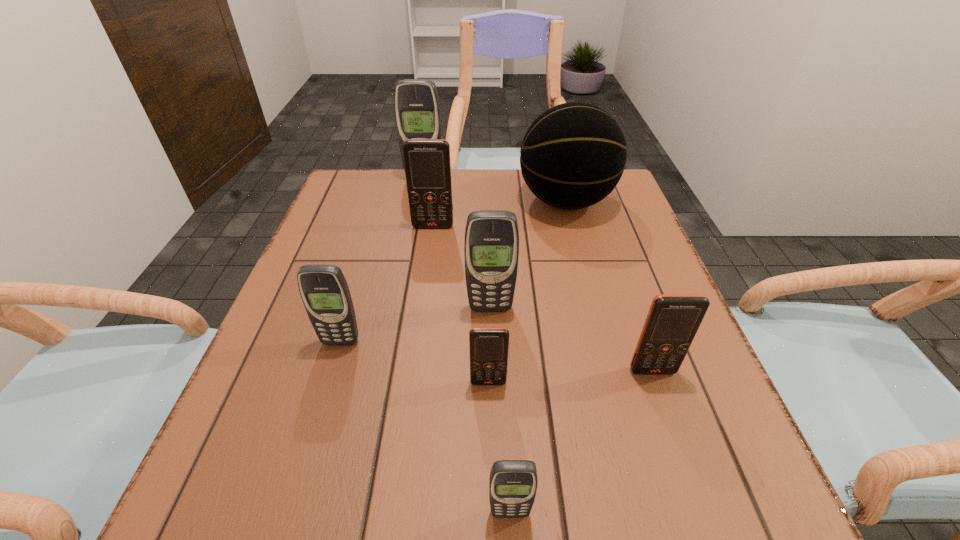
At what (x,y) coordinates should I click in order to perform the action: click on free space located 0.120m on the screen of the third nearest object. Please return your answer as a coordinate pair (x, y). The width and height of the screenshot is (960, 540). Looking at the image, I should click on (678, 442).

Identify the location of vacant space located 0.140m on the screen of the sixth farthest cellular telephone. (490, 469).

Where is `cellular telephone at the far edge`? cellular telephone at the far edge is located at coordinates pos(417,109).

The image size is (960, 540). In order to click on basketball positioned at the far edge in this screenshot , I will do `click(573, 155)`.

The image size is (960, 540). I want to click on object present at the near edge, so click(513, 483).

Locate an element on the screen. The width and height of the screenshot is (960, 540). object located in the left edge section of the desktop is located at coordinates (324, 290).

At what (x,y) coordinates should I click in order to perform the action: click on basketball located in the right edge section of the desktop. Please return your answer as a coordinate pair (x, y). The image size is (960, 540). Looking at the image, I should click on (573, 155).

At what (x,y) coordinates should I click in order to perform the action: click on cellular telephone that is at the right edge. Please return your answer as a coordinate pair (x, y). Image resolution: width=960 pixels, height=540 pixels. Looking at the image, I should click on (673, 320).

Image resolution: width=960 pixels, height=540 pixels. In order to click on object that is at the far right corner in this screenshot , I will do `click(573, 155)`.

Find the location of `free region at the near edge`. free region at the near edge is located at coordinates (448, 503).